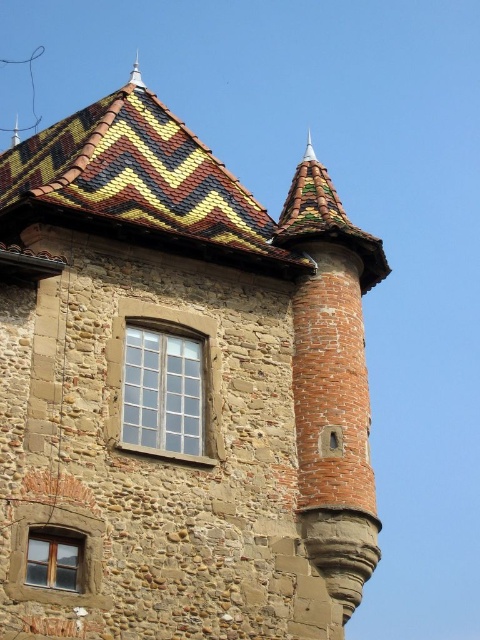
Locate an element on the screen. multicolored tiled roof at upper center is located at coordinates (139, 177).

This screenshot has width=480, height=640. What do you see at coordinates (139, 177) in the screenshot? I see `multicolored tiled roof at upper center` at bounding box center [139, 177].

You are a GUI agent. You are given a task and a screenshot of the screen. Output one action in this format:
    pyautogui.click(x=<x>, y=<y>)
    Task: Click on the multicolored tiled roof at upper center
    
    Given the screenshot: What is the action you would take?
    pyautogui.click(x=139, y=177)

The image size is (480, 640). I want to click on multicolored tiled roof at upper center, so click(139, 177).

Which is more to the left, multicolored tiled roof at upper center or wooden window at lower left?

multicolored tiled roof at upper center is more to the left.

Measure the distance from multicolored tiled roof at upper center to wooden window at lower left.

multicolored tiled roof at upper center and wooden window at lower left are 11.99 meters apart from each other.

You are a GUI agent. You are given a task and a screenshot of the screen. Output one action in this format:
    pyautogui.click(x=<x>, y=<y>)
    Task: Click on the multicolored tiled roof at upper center
    The width and height of the screenshot is (480, 640).
    Given the screenshot: What is the action you would take?
    point(139,177)

Consider the image. Does clear glass window at center have a larger size compared to wooden window at lower left?

Correct, clear glass window at center is larger in size than wooden window at lower left.

Who is positioned more to the right, clear glass window at center or wooden window at lower left?

clear glass window at center

The width and height of the screenshot is (480, 640). What are the coordinates of `clear glass window at center` in the screenshot? It's located at (168, 385).